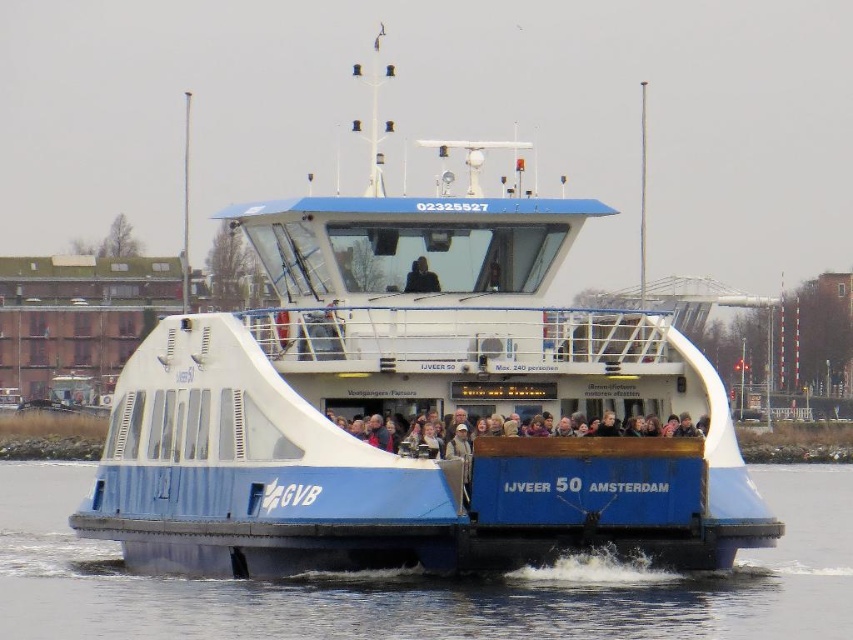
You are standing on the ferry IJveer 50 and want to take a photo of the dark blue fabric jacket at center while avoiding the blue smooth water at center in the foreground. Where should you position yourself to ensure the jacket is visible without the water blocking it?

The blue smooth water at center is closer to the viewer than the dark blue fabric jacket at center. To avoid the water blocking the jacket, move to a position where you can angle your camera upwards so the jacket appears above the water in the frame.

You are standing on the ferry IJveer 50 in Amsterdam and want to take a photo. You have two points marked on the ferry deck at coordinates point (544, 278) and point (520, 451). Which point is closer to you when you are facing the front of the ferry?

Point (544, 278) is closer to you because it is further to the viewer than point (520, 451).